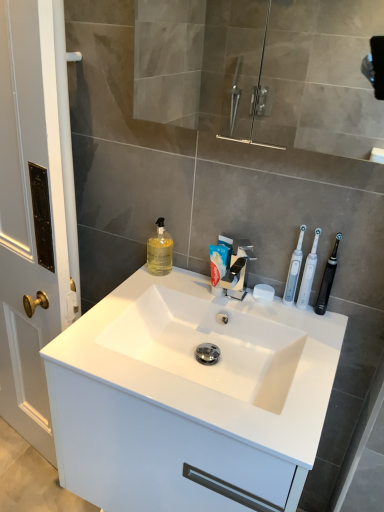
I want to click on empty space that is to the right of polished chrome faucet at center, so click(284, 320).